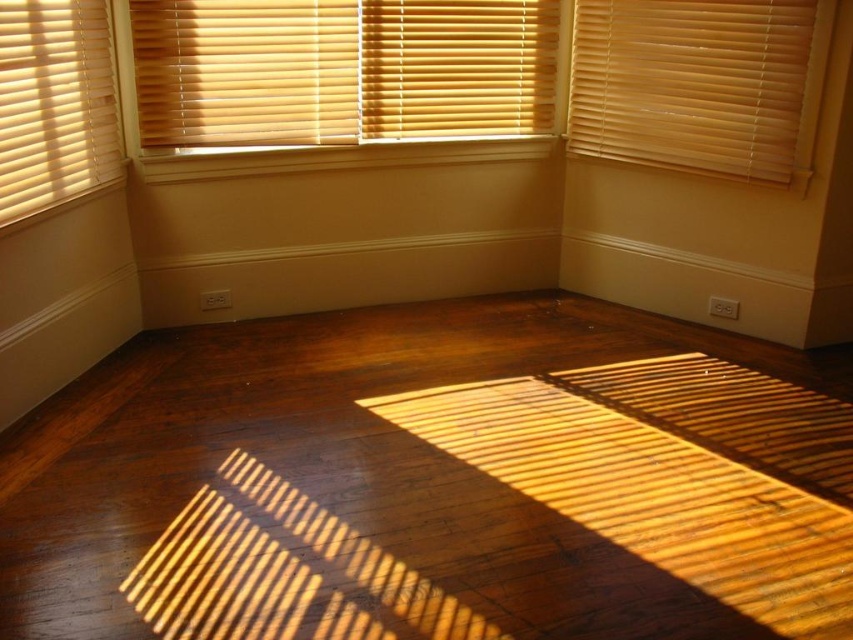
Question: Which object appears closest to the camera in this image?

Choices:
 (A) wooden blinds at upper right
 (B) beige wood blinds at left

Answer: (B)

Question: Does wooden blinds at upper center have a greater width compared to beige wood blinds at left?

Choices:
 (A) yes
 (B) no

Answer: (A)

Question: Which object is positioned farthest from the beige wood blinds at left?

Choices:
 (A) wooden blinds at upper right
 (B) wooden blinds at upper center

Answer: (A)

Question: Is wooden blinds at upper center to the left of beige wood blinds at left from the viewer's perspective?

Choices:
 (A) no
 (B) yes

Answer: (A)

Question: Considering the real-world distances, which object is closest to the beige wood blinds at left?

Choices:
 (A) wooden blinds at upper center
 (B) wooden blinds at upper right

Answer: (A)

Question: Is wooden blinds at upper center in front of wooden blinds at upper right?

Choices:
 (A) no
 (B) yes

Answer: (A)